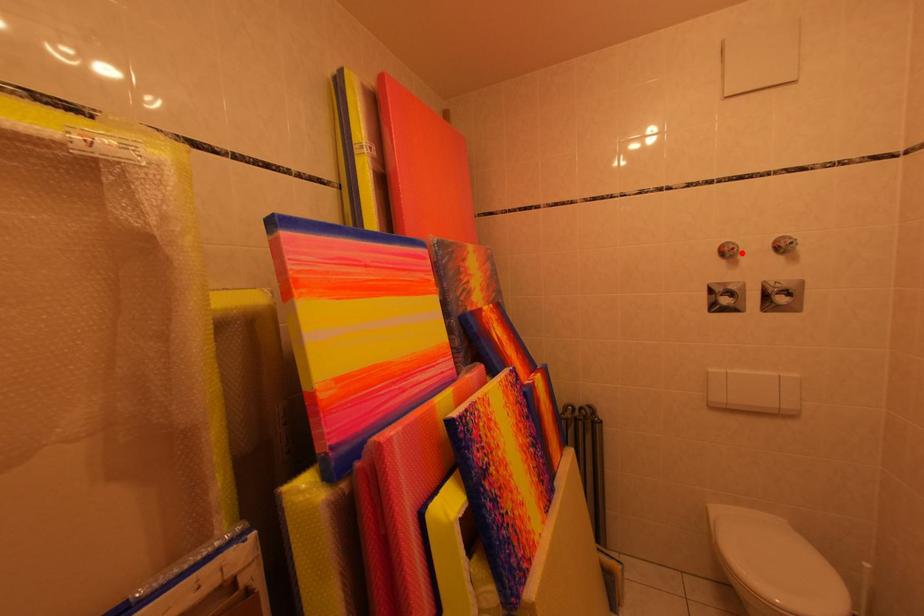
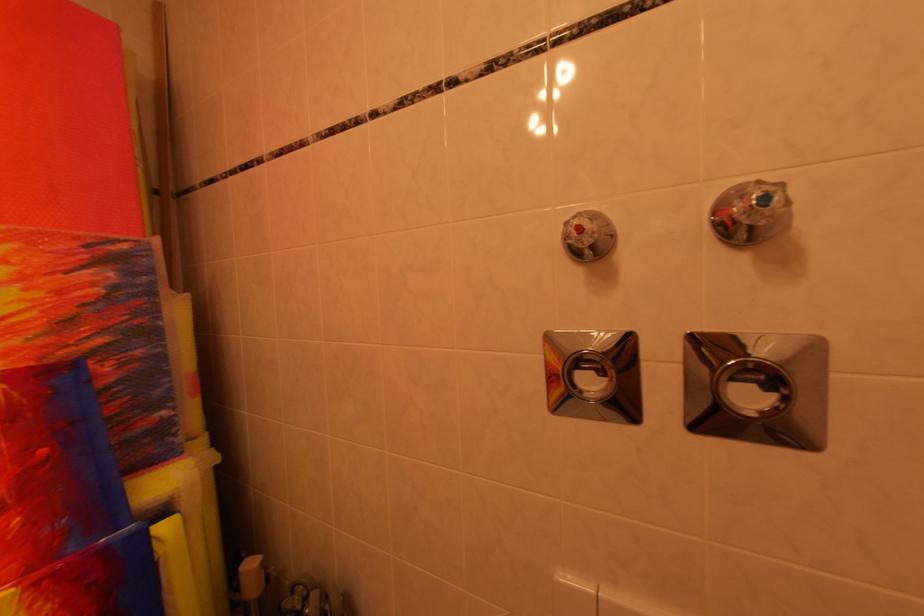
Question: I am providing you with two images of the same scene from different viewpoints. A red point is marked on the first image. Is the red point's position out of view in image 2?

Choices:
 (A) Yes
 (B) No

Answer: (B)